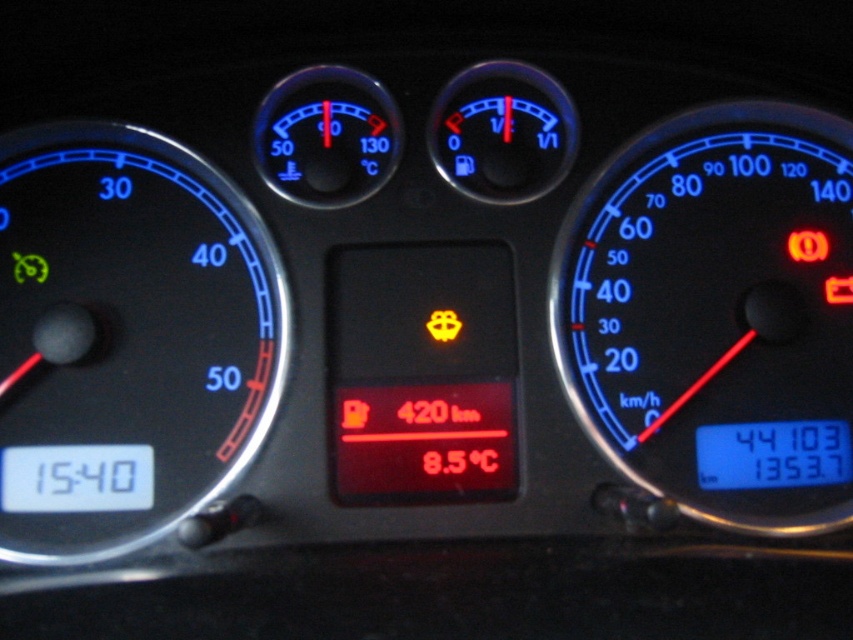
Question: Which object appears farthest from the camera in this image?

Choices:
 (A) black plastic speedometer at left
 (B) blue plastic speedometer at right

Answer: (B)

Question: Does blue plastic speedometer at right have a greater width compared to black plastic speedometer at left?

Choices:
 (A) yes
 (B) no

Answer: (A)

Question: Is blue plastic speedometer at right smaller than black plastic speedometer at left?

Choices:
 (A) yes
 (B) no

Answer: (A)

Question: From the image, what is the correct spatial relationship of blue plastic speedometer at right in relation to black plastic speedometer at left?

Choices:
 (A) above
 (B) below

Answer: (A)

Question: Which object appears farthest from the camera in this image?

Choices:
 (A) black plastic speedometer at left
 (B) blue plastic speedometer at right

Answer: (B)

Question: Which point is closer to the camera?

Choices:
 (A) (82, 358)
 (B) (833, 129)

Answer: (A)